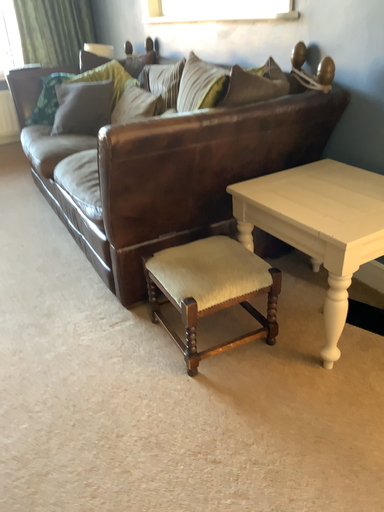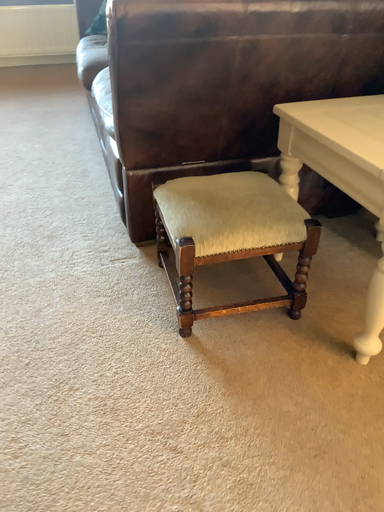
Question: How did the camera likely rotate when shooting the video?

Choices:
 (A) rotated left
 (B) rotated right

Answer: (A)